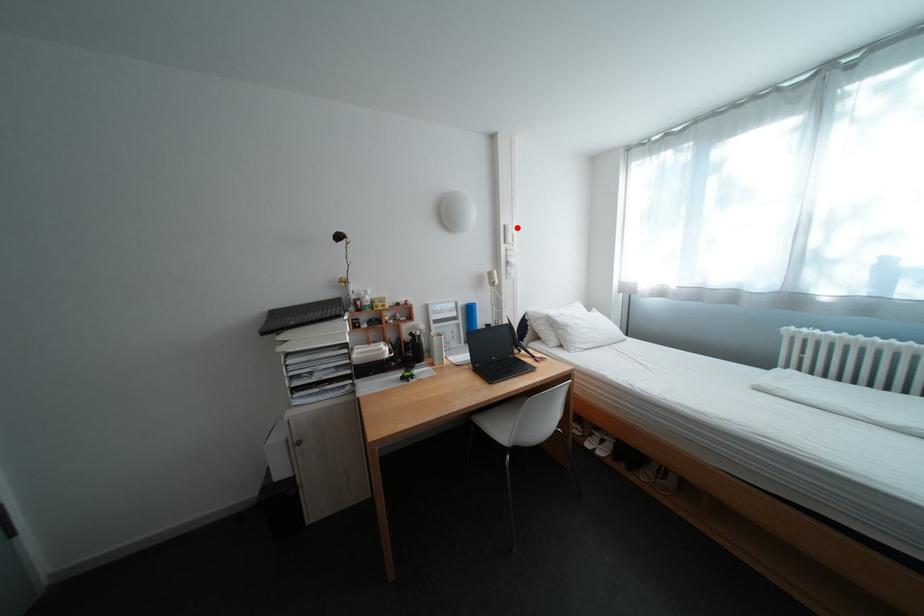
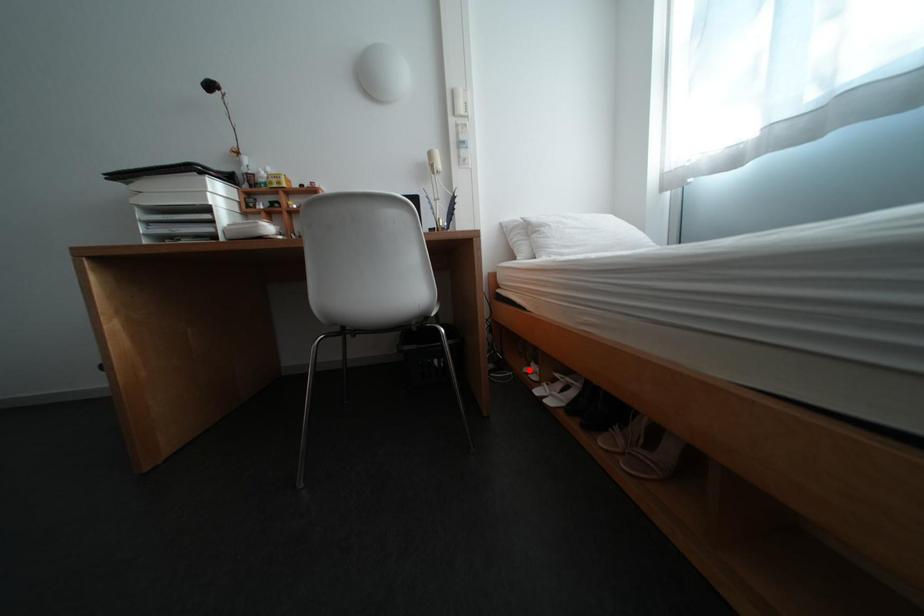
I am providing you with two images of the same scene from different viewpoints. A red point is marked on the first image and another point is marked on the second image. Is the marked point in image1 the same physical position as the marked point in image2?

No